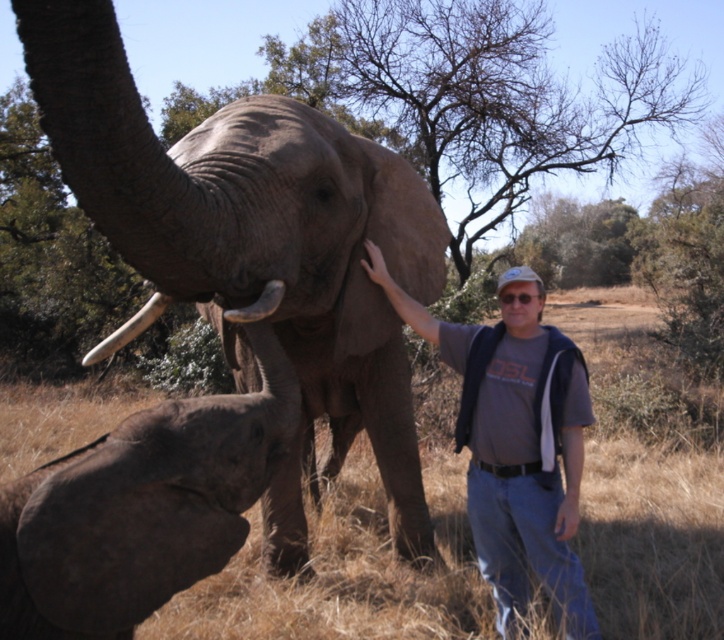
Question: Can you confirm if white ivory tusk at upper left is positioned below white ivory tusk at center?

Choices:
 (A) yes
 (B) no

Answer: (A)

Question: Does gray textured elephant at center have a smaller size compared to gray matte elephant at lower left?

Choices:
 (A) no
 (B) yes

Answer: (A)

Question: Among these points, which one is farthest from the camera?

Choices:
 (A) (481, 365)
 (B) (77, 492)
 (C) (269, 307)
 (D) (146, 326)

Answer: (A)

Question: Estimate the real-world distances between objects in this image. Which object is farther from the white ivory tusk at upper left?

Choices:
 (A) gray fabric shirt at center
 (B) gray matte elephant at lower left

Answer: (A)

Question: Which point is closer to the camera?

Choices:
 (A) gray fabric shirt at center
 (B) white ivory tusk at center

Answer: (B)

Question: Is the position of gray matte elephant at lower left more distant than that of white ivory tusk at center?

Choices:
 (A) no
 (B) yes

Answer: (A)